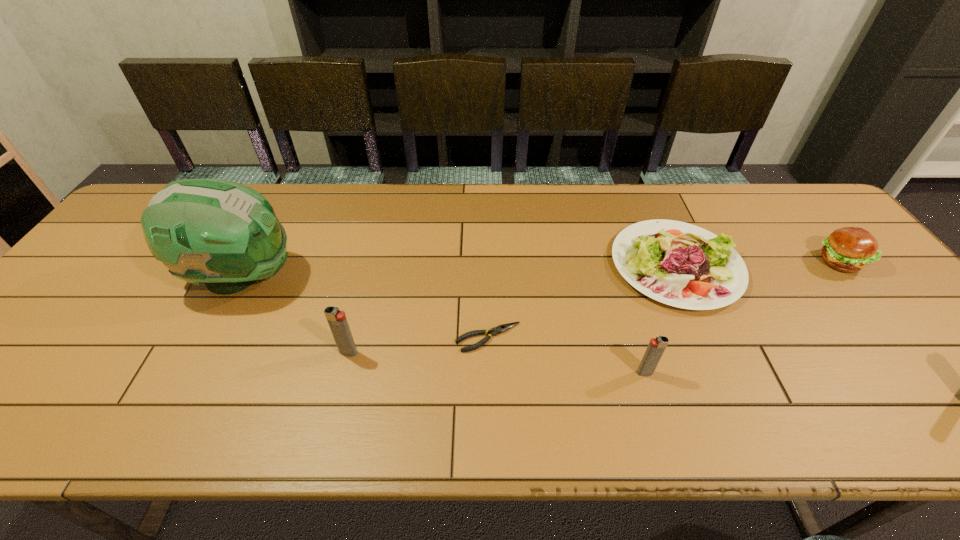
Where is `the left igniter`? Image resolution: width=960 pixels, height=540 pixels. the left igniter is located at coordinates (337, 321).

Where is `the fifth object from right to left`? the fifth object from right to left is located at coordinates (337, 321).

You are a GUI agent. You are given a task and a screenshot of the screen. Output one action in this format:
    pyautogui.click(x=<x>, y=<y>)
    Task: Click on the fourth shortest object
    
    Given the screenshot: What is the action you would take?
    pyautogui.click(x=656, y=347)

This screenshot has width=960, height=540. I want to click on the nearer igniter, so click(656, 347).

Where is `the tallest object`? the tallest object is located at coordinates (226, 234).

Image resolution: width=960 pixels, height=540 pixels. Find the location of `the leftmost object`. the leftmost object is located at coordinates (226, 234).

Identify the location of the third shortest object. (850, 249).

Image resolution: width=960 pixels, height=540 pixels. In order to click on hamburger in this screenshot , I will do `click(850, 249)`.

Where is `the third object from left to right`? The width and height of the screenshot is (960, 540). the third object from left to right is located at coordinates (494, 331).

At what (x,y) coordinates should I click in order to perform the action: click on pliers. Please return your answer as a coordinate pair (x, y). This screenshot has width=960, height=540. Looking at the image, I should click on (494, 331).